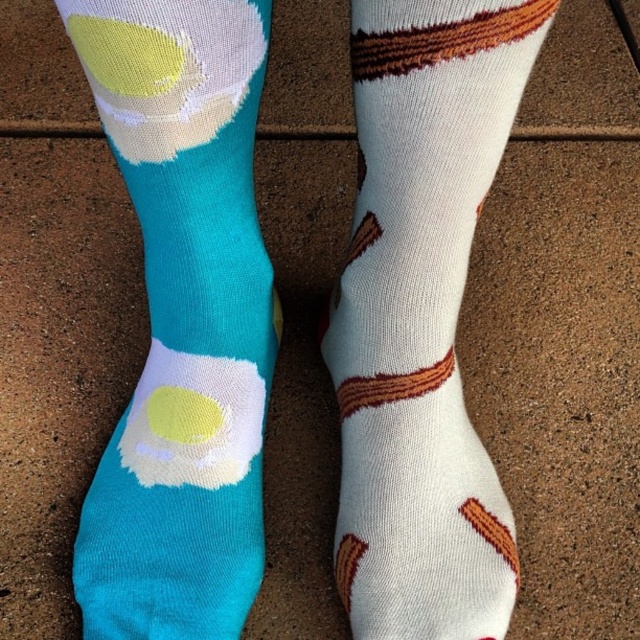
Question: Does turquoise soft cotton socks at left appear on the right side of white cotton socks with brown stripes at right?

Choices:
 (A) yes
 (B) no

Answer: (B)

Question: Does turquoise soft cotton socks at left have a smaller size compared to white cotton socks with brown stripes at right?

Choices:
 (A) no
 (B) yes

Answer: (B)

Question: Which of the following is the farthest from the observer?

Choices:
 (A) (184, 529)
 (B) (465, 573)

Answer: (A)

Question: Which object is closer to the camera taking this photo?

Choices:
 (A) turquoise soft cotton socks at left
 (B) white cotton socks with brown stripes at right

Answer: (B)

Question: Which point is farther to the camera?

Choices:
 (A) white cotton socks with brown stripes at right
 (B) turquoise soft cotton socks at left

Answer: (B)

Question: Does turquoise soft cotton socks at left have a lesser width compared to white cotton socks with brown stripes at right?

Choices:
 (A) no
 (B) yes

Answer: (A)